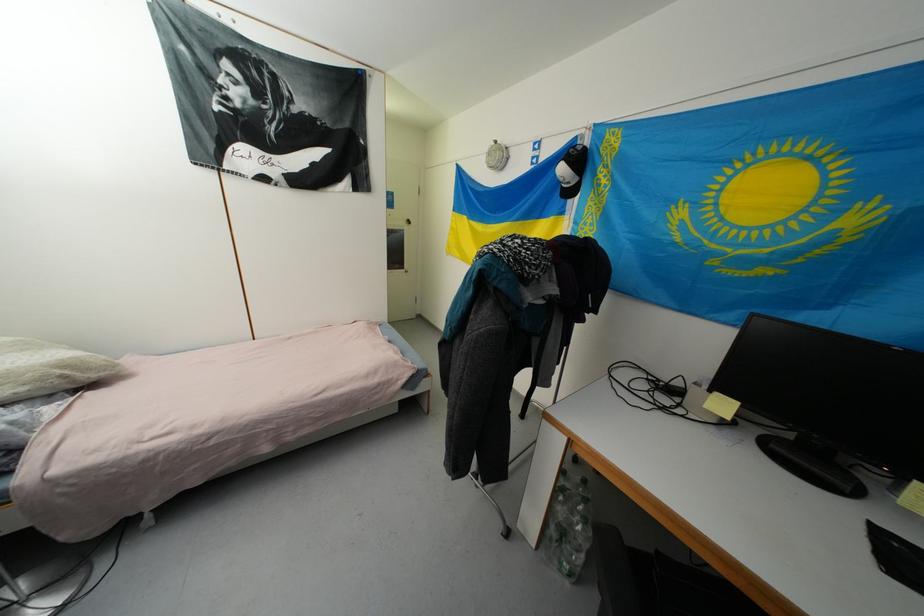
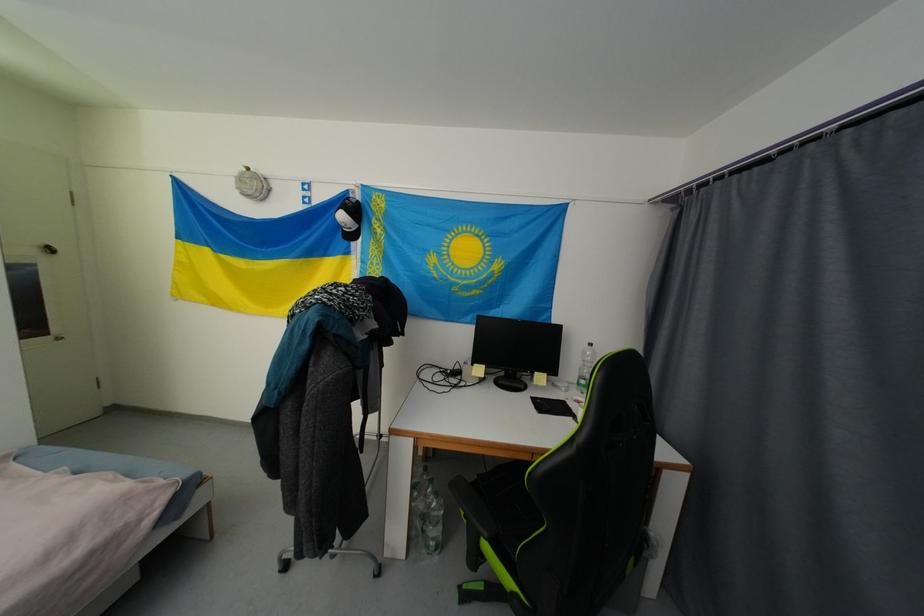
The point at (723, 395) is marked in the first image. Where is the corresponding point in the second image?

(480, 367)